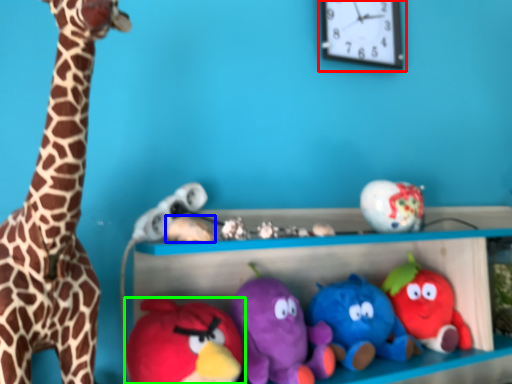
Question: Considering the real-world distances, which object is farthest from clock (highlighted by a red box)? toy (highlighted by a blue box) or toy (highlighted by a green box)?

Choices:
 (A) toy
 (B) toy

Answer: (B)